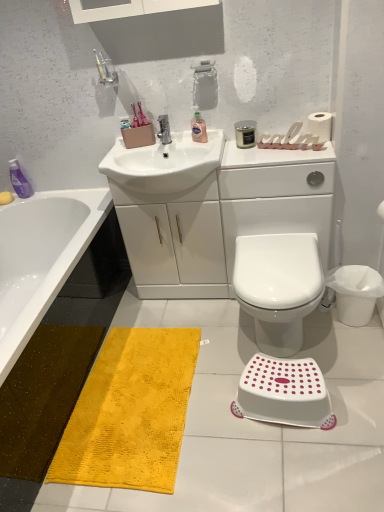
The width and height of the screenshot is (384, 512). Find the location of `vacant region above white glossy toilet at center (from a real-world perspective)`. vacant region above white glossy toilet at center (from a real-world perspective) is located at coordinates pos(282,266).